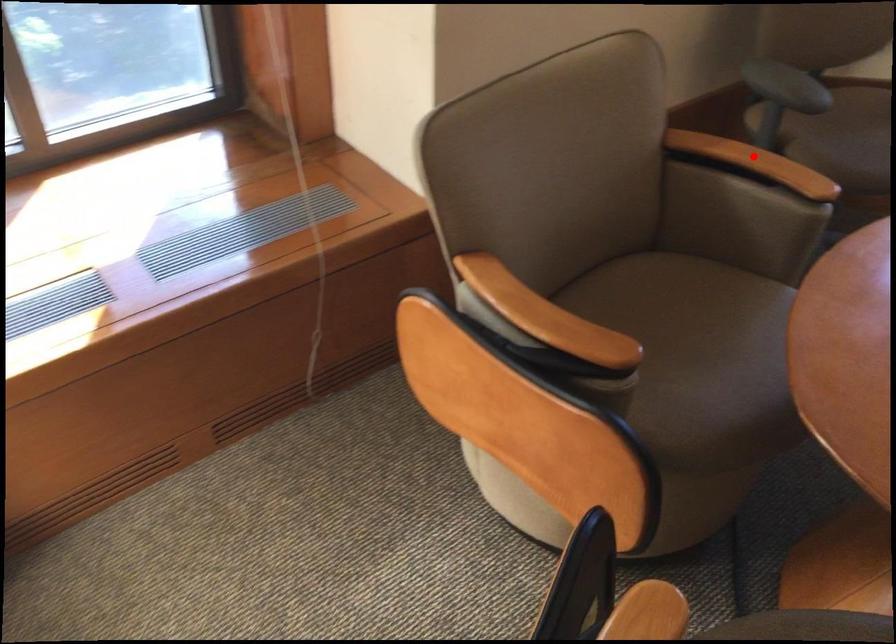
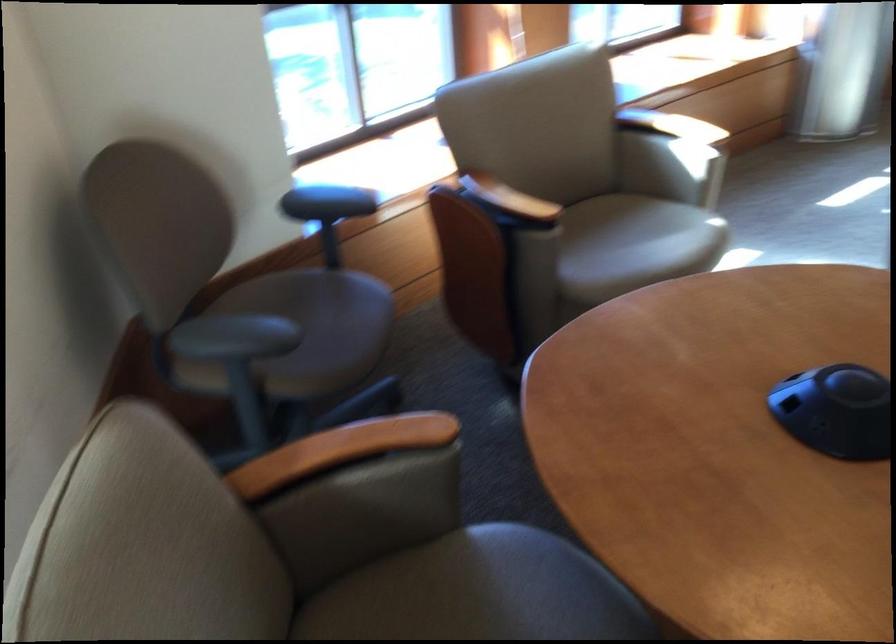
Locate, in the second image, the point that corresponds to the highlighted location in the first image.

(340, 450)